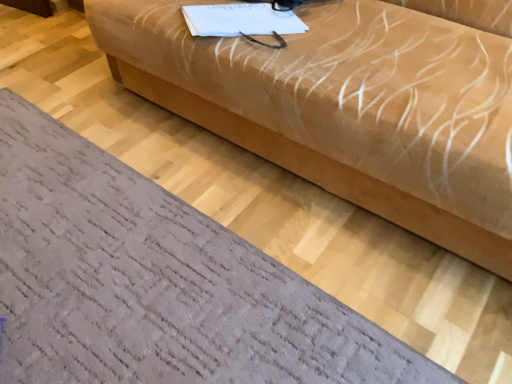
Where is `beige fabric couch at center`? Image resolution: width=512 pixels, height=384 pixels. beige fabric couch at center is located at coordinates (347, 108).

The image size is (512, 384). Describe the element at coordinates (347, 108) in the screenshot. I see `beige fabric couch at center` at that location.

Locate an element on the screen. This screenshot has width=512, height=384. textured gray rug at lower left is located at coordinates (155, 283).

What is the approximate width of textured gray rug at lower left?

1.90 meters.

What do you see at coordinates (155, 283) in the screenshot?
I see `textured gray rug at lower left` at bounding box center [155, 283].

The width and height of the screenshot is (512, 384). What are the coordinates of `beige fabric couch at center` in the screenshot? It's located at (347, 108).

Which object is positioned more to the right, beige fabric couch at center or textured gray rug at lower left?

Positioned to the right is beige fabric couch at center.

From the picture: Does beige fabric couch at center come behind textured gray rug at lower left?

No.

Does point (125, 13) appear closer or farther from the camera than point (218, 280)?

Clearly, point (125, 13) is more distant from the camera than point (218, 280).

From the image's perspective, is beige fabric couch at center above or below textured gray rug at lower left?

Clearly, from the image's perspective, beige fabric couch at center is above textured gray rug at lower left.

From a real-world perspective, is beige fabric couch at center located beneath textured gray rug at lower left?

Incorrect, from a real-world perspective, beige fabric couch at center is higher than textured gray rug at lower left.

Does beige fabric couch at center have a greater width compared to textured gray rug at lower left?

Incorrect, the width of beige fabric couch at center does not surpass that of textured gray rug at lower left.

Does beige fabric couch at center have a lesser height compared to textured gray rug at lower left?

In fact, beige fabric couch at center may be taller than textured gray rug at lower left.

Based on the photo, between beige fabric couch at center and textured gray rug at lower left, which one has smaller size?

Smaller between the two is textured gray rug at lower left.

Choose the correct answer: Is beige fabric couch at center inside textured gray rug at lower left or outside it?

beige fabric couch at center is not inside textured gray rug at lower left, it's outside.

Is there a large distance between beige fabric couch at center and textured gray rug at lower left?

No, beige fabric couch at center is in close proximity to textured gray rug at lower left.

Is beige fabric couch at center turned away from textured gray rug at lower left?

No, beige fabric couch at center is not facing the opposite direction of textured gray rug at lower left.

How many degrees apart are the facing directions of beige fabric couch at center and textured gray rug at lower left?

90.5 degrees separate the facing orientations of beige fabric couch at center and textured gray rug at lower left.

How much distance is there between beige fabric couch at center and textured gray rug at lower left?

beige fabric couch at center is 19.84 inches from textured gray rug at lower left.

Locate an element on the screen. The width and height of the screenshot is (512, 384). studio couch lying on the right of textured gray rug at lower left is located at coordinates (347, 108).

Is textured gray rug at lower left at the right side of beige fabric couch at center?

Incorrect, textured gray rug at lower left is not on the right side of beige fabric couch at center.

Does textured gray rug at lower left come in front of beige fabric couch at center?

No, the depth of textured gray rug at lower left is greater than that of beige fabric couch at center.

Between point (261, 258) and point (424, 184), which one is positioned behind?

Positioned behind is point (261, 258).

From the picture: From the image's perspective, is textured gray rug at lower left on top of beige fabric couch at center?

Incorrect, from the image's perspective, textured gray rug at lower left is lower than beige fabric couch at center.

From a real-world perspective, is textured gray rug at lower left located higher than beige fabric couch at center?

No, from a real-world perspective, textured gray rug at lower left is not on top of beige fabric couch at center.

Considering the sizes of objects textured gray rug at lower left and beige fabric couch at center in the image provided, who is thinner, textured gray rug at lower left or beige fabric couch at center?

With smaller width is beige fabric couch at center.

Considering the sizes of textured gray rug at lower left and beige fabric couch at center in the image, is textured gray rug at lower left taller or shorter than beige fabric couch at center?

textured gray rug at lower left is shorter than beige fabric couch at center.

Is textured gray rug at lower left bigger than beige fabric couch at center?

Incorrect, textured gray rug at lower left is not larger than beige fabric couch at center.

Is textured gray rug at lower left not within beige fabric couch at center?

Yes.

Looking at this image, is textured gray rug at lower left positioned far away from beige fabric couch at center?

No, textured gray rug at lower left is in close proximity to beige fabric couch at center.

Is textured gray rug at lower left facing towards beige fabric couch at center?

No.

Can you tell me how much textured gray rug at lower left and beige fabric couch at center differ in facing direction?

There is a 90.5-degree angle between the facing directions of textured gray rug at lower left and beige fabric couch at center.

Locate an element on the screen. This screenshot has width=512, height=384. studio couch on the right of textured gray rug at lower left is located at coordinates (347, 108).

Image resolution: width=512 pixels, height=384 pixels. Find the location of `furniture on the left of beige fabric couch at center`. furniture on the left of beige fabric couch at center is located at coordinates (155, 283).

The width and height of the screenshot is (512, 384). Find the location of `furniture that is behind the beige fabric couch at center`. furniture that is behind the beige fabric couch at center is located at coordinates (155, 283).